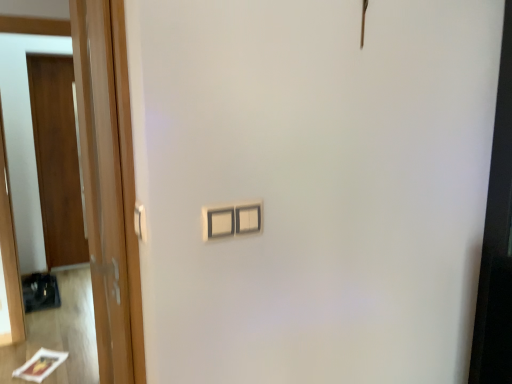
Measure the distance between wooden door at left and camera.

wooden door at left and camera are 2.46 meters apart from each other.

You are a GUI agent. You are given a task and a screenshot of the screen. Output one action in this format:
    pyautogui.click(x=<x>, y=<y>)
    Task: Click on the wooden door at left, arranged as the 2th door when viewed from the front
    
    Given the screenshot: What is the action you would take?
    pyautogui.click(x=57, y=158)

What do you see at coordinates (140, 221) in the screenshot?
I see `white plastic door handle at left` at bounding box center [140, 221].

The image size is (512, 384). What do you see at coordinates (232, 220) in the screenshot? I see `white plastic light switch at center` at bounding box center [232, 220].

What are the coordinates of `wooden door at left, which is counted as the 1th door, starting from the right` in the screenshot? It's located at (109, 185).

Can you confirm if wooden door at left, which is the 1th door from front to back, is wider than wooden door at left, which is the 2th door from right to left?

Yes, wooden door at left, which is the 1th door from front to back, is wider than wooden door at left, which is the 2th door from right to left.

Can you confirm if wooden door at left, acting as the 2th door starting from the back, is taller than wooden door at left, the 1th door from the left?

Incorrect, the height of wooden door at left, acting as the 2th door starting from the back, is not larger of that of wooden door at left, the 1th door from the left.

From a real-world perspective, which is physically below, wooden door at left, which is the 1th door from front to back, or wooden door at left, arranged as the 2th door when viewed from the front?

From a 3D spatial view, wooden door at left, arranged as the 2th door when viewed from the front, is below.

Is white plastic light switch at center in front of or behind white plastic door handle at left in the image?

white plastic light switch at center is positioned farther from the viewer than white plastic door handle at left.

Does point (212, 230) appear closer or farther from the camera than point (142, 228)?

Clearly, point (212, 230) is more distant from the camera than point (142, 228).

From the picture: From a real-world perspective, is white plastic light switch at center over white plastic door handle at left?

Actually, white plastic light switch at center is physically below white plastic door handle at left in the real world.

Which point is more forward, (116,227) or (135,211)?

The point (135,211) is closer.

Is wooden door at left, acting as the 2th door starting from the back, oriented towards white plastic door handle at left?

No, wooden door at left, acting as the 2th door starting from the back, is not aimed at white plastic door handle at left.

Considering the sizes of objects wooden door at left, acting as the 2th door starting from the back, and white plastic door handle at left in the image provided, who is smaller, wooden door at left, acting as the 2th door starting from the back, or white plastic door handle at left?

white plastic door handle at left is smaller.

Considering the sizes of objects wooden door at left, which ranks as the second door in left-to-right order, and white plastic door handle at left in the image provided, who is taller, wooden door at left, which ranks as the second door in left-to-right order, or white plastic door handle at left?

With more height is wooden door at left, which ranks as the second door in left-to-right order.

Is white plastic door handle at left surrounded by wooden door at left?

That's incorrect, white plastic door handle at left is not inside wooden door at left.

From a real-world perspective, is wooden door at left on top of white plastic door handle at left?

Incorrect, from a real-world perspective, wooden door at left is lower than white plastic door handle at left.

Considering the positions of points (36, 324) and (135, 210), is point (36, 324) closer to camera compared to point (135, 210)?

That is False.

Consider the image. Between wooden door at left and white plastic door handle at left, which one appears on the right side from the viewer's perspective?

From the viewer's perspective, white plastic door handle at left appears more on the right side.

Does white plastic door handle at left contain white plastic light switch at center?

No.

Is point (141, 207) closer or farther from the camera than point (253, 228)?

Point (141, 207).

Between white plastic door handle at left and white plastic light switch at center, which one has smaller size?

white plastic door handle at left is smaller.

Which object is thinner, white plastic door handle at left or white plastic light switch at center?

white plastic door handle at left.

From the picture: Does white plastic light switch at center have a larger size compared to wooden door at left, the 1th door from the left?

No, white plastic light switch at center is not bigger than wooden door at left, the 1th door from the left.

Is the position of white plastic light switch at center less distant than that of wooden door at left, which ranks as the 1th door in back-to-front order?

Yes, white plastic light switch at center is in front of wooden door at left, which ranks as the 1th door in back-to-front order.

Considering the positions of objects white plastic light switch at center and wooden door at left, which is the 2th door from right to left, in the image provided, who is more to the left, white plastic light switch at center or wooden door at left, which is the 2th door from right to left,?

From the viewer's perspective, wooden door at left, which is the 2th door from right to left, appears more on the left side.

Is white plastic light switch at center surrounding wooden door at left, which is the 2th door from right to left?

No, wooden door at left, which is the 2th door from right to left, is not inside white plastic light switch at center.

Could you tell me if wooden door at left is turned towards white plastic light switch at center?

Yes, wooden door at left is turned towards white plastic light switch at center.

Which point is more forward, (1, 358) or (203, 208)?

The point (203, 208) is closer to the camera.

Does wooden door at left have a lesser width compared to white plastic light switch at center?

In fact, wooden door at left might be wider than white plastic light switch at center.

What's the angular difference between wooden door at left and white plastic light switch at center's facing directions?

0.473 degrees separate the facing orientations of wooden door at left and white plastic light switch at center.

You are a GUI agent. You are given a task and a screenshot of the screen. Output one action in this format:
    pyautogui.click(x=<x>, y=<y>)
    Task: Click on the door beneath the wooden door at left, which is counted as the 1th door, starting from the right (from a real-world perspective)
    
    Given the screenshot: What is the action you would take?
    pyautogui.click(x=57, y=158)

You are a GUI agent. You are given a task and a screenshot of the screen. Output one action in this format:
    pyautogui.click(x=<x>, y=<y>)
    Task: Click on the light switch to the right of white plastic door handle at left
    This screenshot has width=512, height=384.
    Given the screenshot: What is the action you would take?
    pyautogui.click(x=232, y=220)

From the image, which object appears to be farther from wooden door at left, white plastic door handle at left or wooden door at left, which is the 1th door from front to back?

Based on the image, white plastic door handle at left appears to be further to wooden door at left.

When comparing their distances from wooden door at left, which is the 2th door from right to left, does wooden door at left or white plastic door handle at left seem further?

white plastic door handle at left is positioned further to the anchor wooden door at left, which is the 2th door from right to left.

From the image, which object appears to be nearer to wooden door at left, arranged as the 2th door when viewed from the front, white plastic light switch at center or wooden door at left?

wooden door at left.

From the image, which object appears to be farther from wooden door at left, the 1th door from the left, wooden door at left or wooden door at left, which is counted as the 1th door, starting from the right?

Among the two, wooden door at left, which is counted as the 1th door, starting from the right, is located further to wooden door at left, the 1th door from the left.

In the scene shown: Looking at the image, which one is located closer to white plastic door handle at left, wooden door at left or wooden door at left, which ranks as the second door in left-to-right order?

wooden door at left, which ranks as the second door in left-to-right order.

From the image, which object appears to be nearer to wooden door at left, white plastic light switch at center or wooden door at left, which is the 1th door from front to back?

wooden door at left, which is the 1th door from front to back, is positioned closer to the anchor wooden door at left.

When comparing their distances from wooden door at left, which is the 1th door from front to back, does white plastic light switch at center or wooden door at left seem further?

wooden door at left.

From the picture: Based on their spatial positions, is wooden door at left or wooden door at left, arranged as the 2th door when viewed from the front, closer to white plastic light switch at center?

wooden door at left is closer to white plastic light switch at center.

Where is `door handle between wooden door at left, which is counted as the 1th door, starting from the right, and wooden door at left, the 1th door from the left, along the z-axis`? door handle between wooden door at left, which is counted as the 1th door, starting from the right, and wooden door at left, the 1th door from the left, along the z-axis is located at coordinates (140, 221).

Identify the location of mirror between white plastic light switch at center and wooden door at left, which is the 2th door from right to left, in the front-back direction. (x=60, y=336).

Where is `light switch between white plastic door handle at left and wooden door at left, which is the 2th door from right to left, in the front-back direction`? light switch between white plastic door handle at left and wooden door at left, which is the 2th door from right to left, in the front-back direction is located at coordinates (232, 220).

Identify the location of light switch positioned between wooden door at left, acting as the 2th door starting from the back, and wooden door at left from near to far. The width and height of the screenshot is (512, 384). (232, 220).